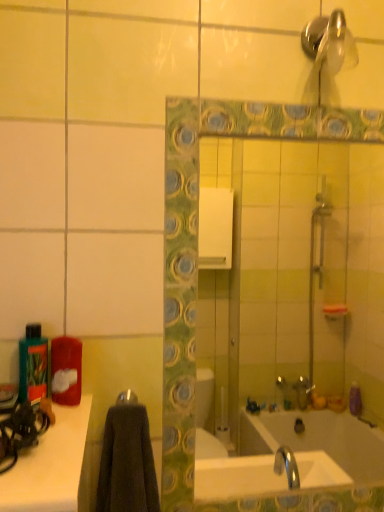
Question: Does point (301, 236) appear closer or farther from the camera than point (34, 367)?

Choices:
 (A) closer
 (B) farther

Answer: (B)

Question: Based on their positions, is green mosaic tile mirror at center located to the left or right of green matte bottle at left?

Choices:
 (A) right
 (B) left

Answer: (A)

Question: Considering the real-world distances, which object is closest to the metallic silver towel bar at center?

Choices:
 (A) shiny metallic shower head at upper right
 (B) green mosaic tile mirror at center
 (C) green matte bottle at left

Answer: (C)

Question: Which of these objects is positioned closest to the metallic silver towel bar at center?

Choices:
 (A) green mosaic tile mirror at center
 (B) shiny metallic shower head at upper right
 (C) green matte bottle at left

Answer: (C)